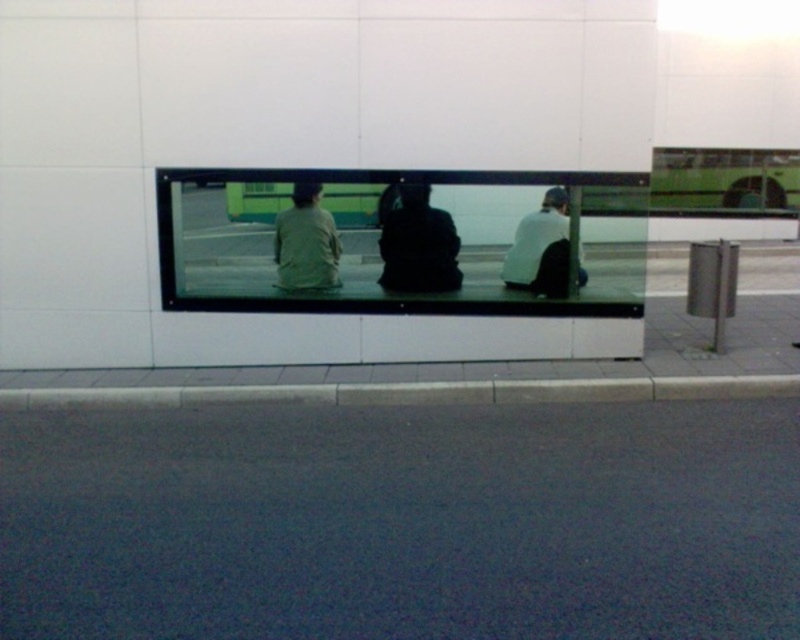
You are standing in front of the mirror and see two points marked on the wall. The first point is at coordinate point (390,227) and the second point is at coordinate point (558,211). Which point is closer to you?

Point (390,227) is further to the camera than point (558,211), so the point closer to you is point (558,211).

You are standing in front of the mirror and notice two points marked on the wall. The first point is at coordinates point (x=389, y=289) and the second is at point (x=310, y=266). Which point is closer to you?

Point (x=389, y=289) is closer to the camera than point (x=310, y=266).